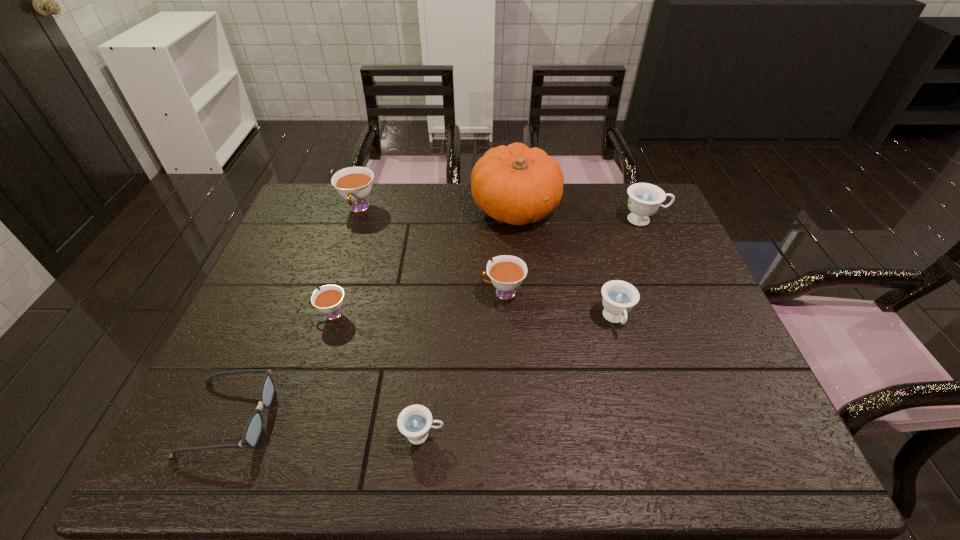
I want to click on vacant area that lies between the second teacup from right to left and the farthest blue teacup, so click(x=630, y=269).

Where is `vacant space that's between the pumpkin and the second smallest blue teacup`? This screenshot has height=540, width=960. vacant space that's between the pumpkin and the second smallest blue teacup is located at coordinates (565, 264).

Find the location of a particular element. vacant point located between the farthest white teacup and the smallest white teacup is located at coordinates (346, 261).

The image size is (960, 540). Identify the location of free space between the second object from right to left and the smallest white teacup. (473, 316).

You are a GUI agent. You are given a task and a screenshot of the screen. Output one action in this format:
    pyautogui.click(x=<x>, y=<y>)
    Task: Click on the free space that is in between the second blue teacup from right to left and the fourth teacup from left to right
    The image size is (960, 540).
    Given the screenshot: What is the action you would take?
    pyautogui.click(x=559, y=306)

Find the location of a particular element. The width and height of the screenshot is (960, 540). free spot between the second biggest white teacup and the gray spectacles is located at coordinates (366, 355).

Identify the location of object that stands as the seventh closest to the smallest blue teacup. This screenshot has height=540, width=960. (644, 199).

Image resolution: width=960 pixels, height=540 pixels. I want to click on object that is the sixth nearest to the smallest white teacup, so click(x=619, y=297).

This screenshot has height=540, width=960. Identify the location of teacup that can be found as the third closest to the smallest white teacup. (354, 184).

Identify which teacup is located as the second nearest to the second biggest white teacup. Please provide its 2D coordinates. Your answer should be formatted as a tuple, i.e. [(x, y)], where the tuple contains the x and y coordinates of a point satisfying the conditions above.

[(414, 422)]